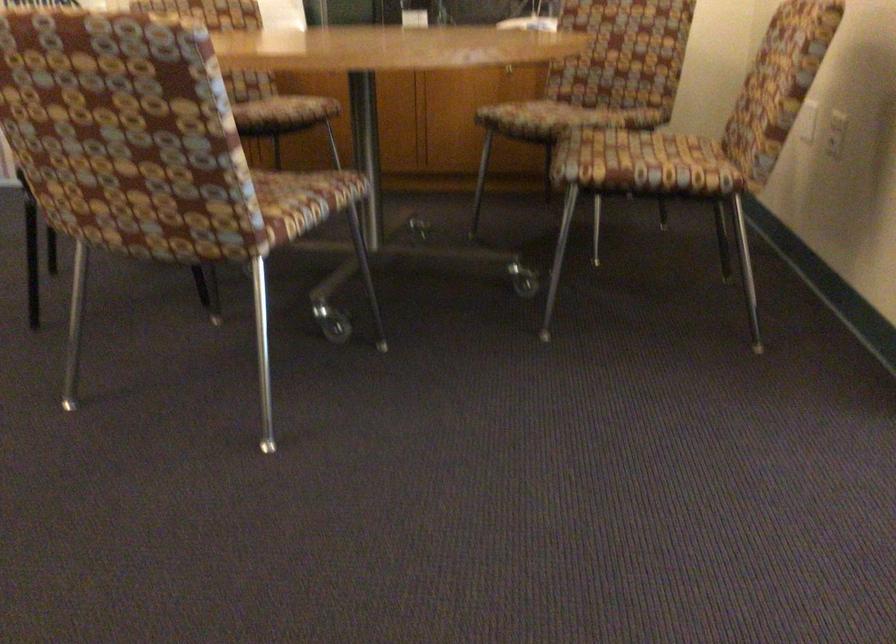
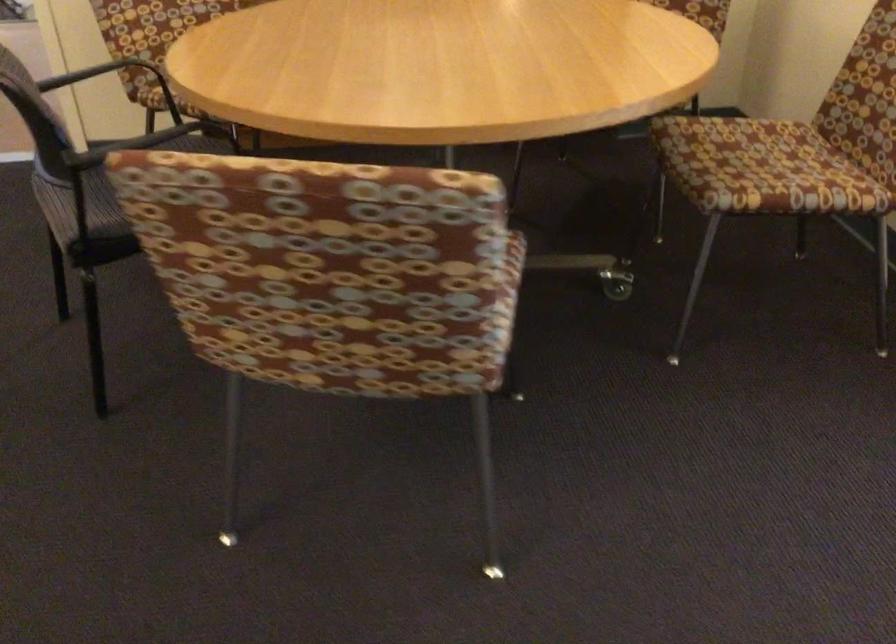
Question: I am providing you with two images of the same scene from different viewpoints. Which of the following objects are not visible in image2?

Choices:
 (A) chair sitting surface
 (B) patterned chair sitting surface
 (C) black magazine
 (D) black chair sitting surface

Answer: (A)